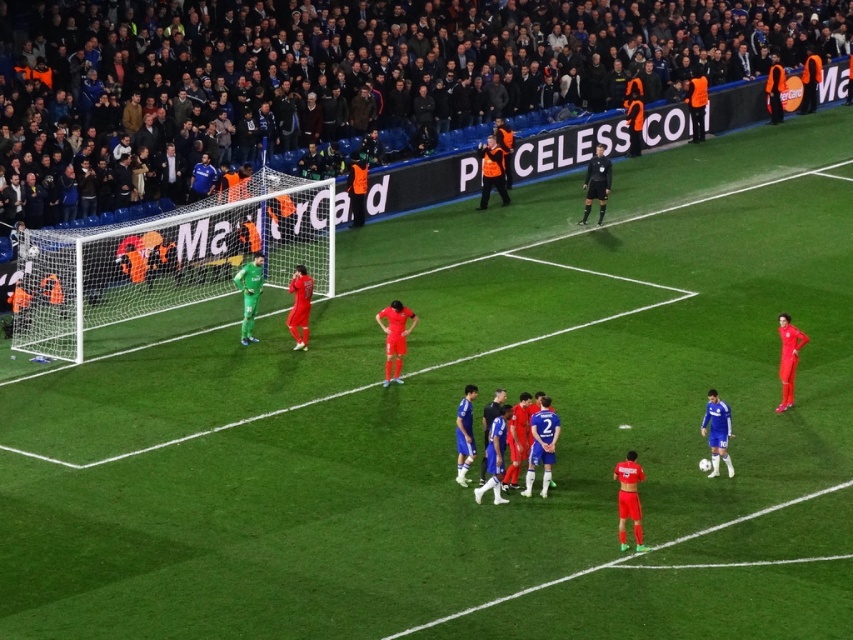
Question: Does dark gray fabric crowd at upper center appear on the left side of green net at left?

Choices:
 (A) yes
 (B) no

Answer: (B)

Question: Which object appears farthest from the camera in this image?

Choices:
 (A) black jersey at center
 (B) dark gray fabric crowd at upper center
 (C) green net at left

Answer: (A)

Question: Can you confirm if dark gray fabric crowd at upper center is wider than green net at left?

Choices:
 (A) yes
 (B) no

Answer: (A)

Question: Which point is closer to the camera taking this photo?

Choices:
 (A) (532, 90)
 (B) (18, 307)
 (C) (602, 163)

Answer: (B)

Question: Among these points, which one is nearest to the camera?

Choices:
 (A) (608, 189)
 (B) (782, 13)
 (C) (165, 257)

Answer: (C)

Question: Does dark gray fabric crowd at upper center have a lesser width compared to green net at left?

Choices:
 (A) yes
 (B) no

Answer: (B)